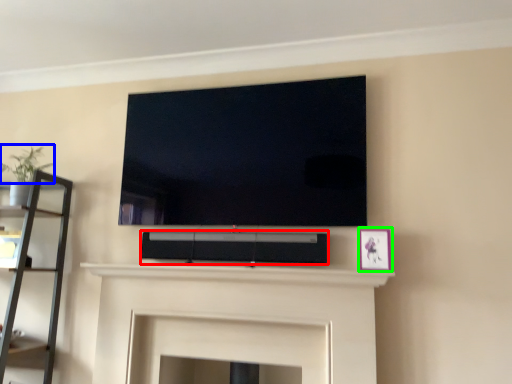
Question: Based on their relative distances, which object is nearer to speaker (highlighted by a red box)? Choose from plant (highlighted by a blue box) and picture frame (highlighted by a green box).

Choices:
 (A) plant
 (B) picture frame

Answer: (B)